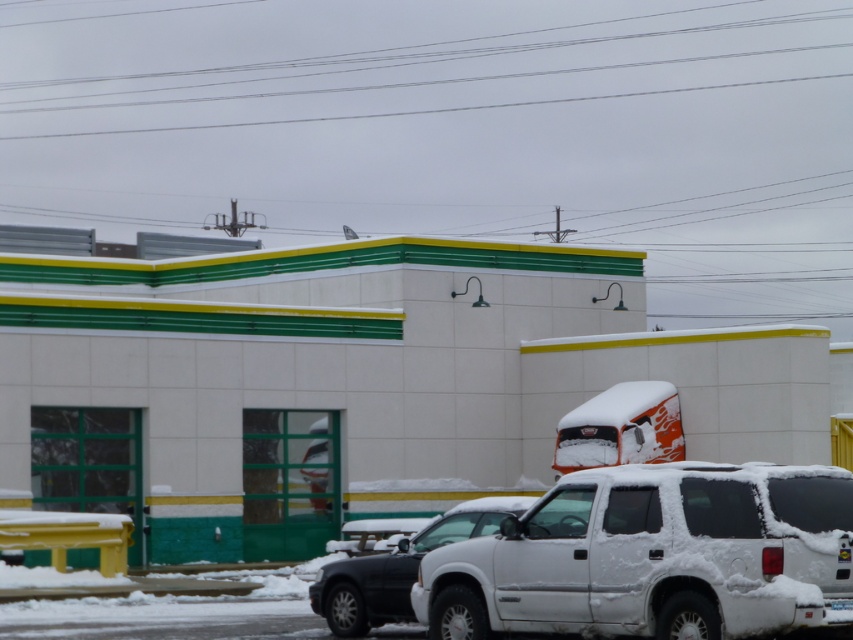
You are a delivery person who needs to park your 5.5 meter long truck between the white matte suv at lower center and the orange matte truck at center. Is there enough space between them to park your truck without touching either vehicle?

The distance between the white matte suv at lower center and the orange matte truck at center is 12.64 meters. Since your truck is 5.5 meters long, there is sufficient space to park it between them without touching either vehicle.

You are a delivery driver who needs to park your orange matte truck at center in a spot that requires backing into the parking space. The white matte suv at lower center is blocking your path. Based on their positions, can you maneuver around the suv to access the parking spot?

The white matte suv at lower center is to the left of the orange matte truck at center, so you can move around the right side of the white matte suv at lower center to access the parking spot.